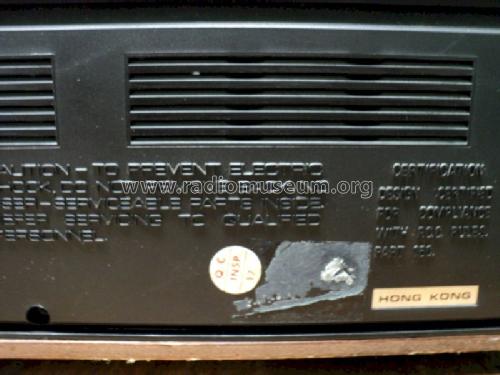
Where is `vents`? vents is located at coordinates (212, 83).